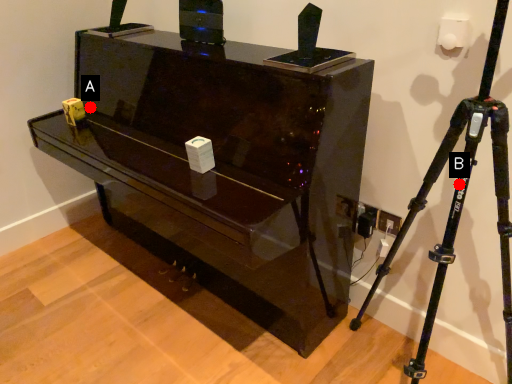
Question: Two points are circled on the image, labeled by A and B beside each circle. Among these points, which one is nearest to the camera?

Choices:
 (A) A is closer
 (B) B is closer

Answer: (B)